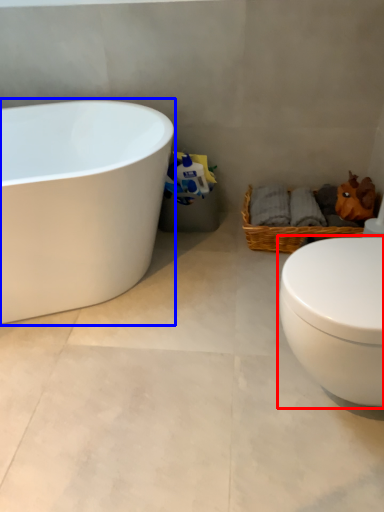
Question: Which point is further to the camera, toilet (highlighted by a red box) or bathtub (highlighted by a blue box)?

Choices:
 (A) toilet
 (B) bathtub

Answer: (B)